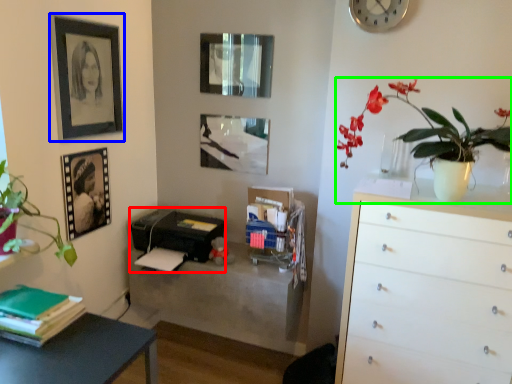
Question: Considering the real-world distances, which object is farthest from printer (highlighted by a red box)? picture frame (highlighted by a blue box) or flower (highlighted by a green box)?

Choices:
 (A) picture frame
 (B) flower

Answer: (B)